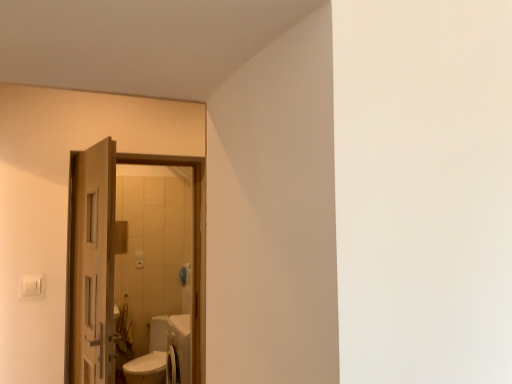
Where is `wooden door at left, placed as the 1th door when sorted from front to back`? wooden door at left, placed as the 1th door when sorted from front to back is located at coordinates (112, 258).

The width and height of the screenshot is (512, 384). Describe the element at coordinates (112, 258) in the screenshot. I see `wooden door at left, placed as the 1th door when sorted from front to back` at that location.

In order to face wooden door at left, positioned as the second door in back-to-front order, should I rotate leftwards or rightwards?

Rotate your view left by about 18.608°.

What do you see at coordinates (92, 265) in the screenshot?
I see `wooden door at left, marked as the second door in a front-to-back arrangement` at bounding box center [92, 265].

What is the approximate width of wooden door at left, marked as the second door in a front-to-back arrangement?

7.17 inches.

Locate an element on the screen. This screenshot has width=512, height=384. wooden door at left, marked as the second door in a front-to-back arrangement is located at coordinates (92, 265).

I want to click on wooden door at left, positioned as the second door in back-to-front order, so click(x=112, y=258).

Which is more to the left, wooden door at left, positioned as the second door in back-to-front order, or wooden door at left, the first door when ordered from back to front?

wooden door at left, the first door when ordered from back to front.

Which object is closer to the camera taking this photo, wooden door at left, placed as the 1th door when sorted from front to back, or wooden door at left, marked as the second door in a front-to-back arrangement?

Positioned in front is wooden door at left, placed as the 1th door when sorted from front to back.

Is point (95, 186) positioned behind point (97, 247)?

Yes, it is behind point (97, 247).

From the image's perspective, between wooden door at left, positioned as the second door in back-to-front order, and wooden door at left, the first door when ordered from back to front, which one is located above?

wooden door at left, positioned as the second door in back-to-front order.

From a real-world perspective, who is located higher, wooden door at left, positioned as the second door in back-to-front order, or wooden door at left, the first door when ordered from back to front?

wooden door at left, positioned as the second door in back-to-front order.

Can you confirm if wooden door at left, positioned as the second door in back-to-front order, is thinner than wooden door at left, the first door when ordered from back to front?

Yes.

Which of these two, wooden door at left, positioned as the second door in back-to-front order, or wooden door at left, the first door when ordered from back to front, stands taller?

wooden door at left, the first door when ordered from back to front, is taller.

Looking at the image, does wooden door at left, placed as the 1th door when sorted from front to back, seem bigger or smaller compared to wooden door at left, the first door when ordered from back to front?

In the image, wooden door at left, placed as the 1th door when sorted from front to back, appears to be smaller than wooden door at left, the first door when ordered from back to front.

Is wooden door at left, positioned as the second door in back-to-front order, outside of wooden door at left, the first door when ordered from back to front?

Yes, wooden door at left, positioned as the second door in back-to-front order, is not within wooden door at left, the first door when ordered from back to front.

Is wooden door at left, placed as the 1th door when sorted from front to back, with wooden door at left, marked as the second door in a front-to-back arrangement?

Yes, wooden door at left, placed as the 1th door when sorted from front to back, is touching wooden door at left, marked as the second door in a front-to-back arrangement.

Is wooden door at left, positioned as the second door in back-to-front order, facing away from wooden door at left, the first door when ordered from back to front?

No, wooden door at left, the first door when ordered from back to front, is not at the back of wooden door at left, positioned as the second door in back-to-front order.

The height and width of the screenshot is (384, 512). Find the location of `door located behind the wooden door at left, placed as the 1th door when sorted from front to back`. door located behind the wooden door at left, placed as the 1th door when sorted from front to back is located at coordinates point(92,265).

In the image, is wooden door at left, marked as the second door in a front-to-back arrangement, on the left side or the right side of wooden door at left, positioned as the second door in back-to-front order?

In the image, wooden door at left, marked as the second door in a front-to-back arrangement, appears on the left side of wooden door at left, positioned as the second door in back-to-front order.

Which is in front, wooden door at left, the first door when ordered from back to front, or wooden door at left, positioned as the second door in back-to-front order?

wooden door at left, positioned as the second door in back-to-front order, is closer to the camera.

Which is in front, point (72, 329) or point (97, 302)?

The point (97, 302) is in front.

From the image's perspective, is wooden door at left, marked as the second door in a front-to-back arrangement, located above or below wooden door at left, positioned as the second door in back-to-front order?

Clearly, from the image's perspective, wooden door at left, marked as the second door in a front-to-back arrangement, is below wooden door at left, positioned as the second door in back-to-front order.

From a real-world perspective, which object stands above the other?

wooden door at left, positioned as the second door in back-to-front order, from a real-world perspective.

Which of these two, wooden door at left, the first door when ordered from back to front, or wooden door at left, placed as the 1th door when sorted from front to back, is thinner?

wooden door at left, placed as the 1th door when sorted from front to back.

Who is taller, wooden door at left, the first door when ordered from back to front, or wooden door at left, positioned as the second door in back-to-front order?

wooden door at left, the first door when ordered from back to front.

Considering the relative sizes of wooden door at left, marked as the second door in a front-to-back arrangement, and wooden door at left, placed as the 1th door when sorted from front to back, in the image provided, is wooden door at left, marked as the second door in a front-to-back arrangement, bigger than wooden door at left, placed as the 1th door when sorted from front to back,?

Yes.

Looking at this image, would you say wooden door at left, the first door when ordered from back to front, contains wooden door at left, placed as the 1th door when sorted from front to back?

Actually, wooden door at left, placed as the 1th door when sorted from front to back, is outside wooden door at left, the first door when ordered from back to front.

Is there a large distance between wooden door at left, the first door when ordered from back to front, and wooden door at left, placed as the 1th door when sorted from front to back?

No.

From the picture: Is wooden door at left, marked as the second door in a front-to-back arrangement, facing away from wooden door at left, positioned as the second door in back-to-front order?

wooden door at left, marked as the second door in a front-to-back arrangement, is not turned away from wooden door at left, positioned as the second door in back-to-front order.

The width and height of the screenshot is (512, 384). In order to click on door on the right of the wooden door at left, marked as the second door in a front-to-back arrangement in this screenshot , I will do `click(112, 258)`.

The width and height of the screenshot is (512, 384). In the image, there is a wooden door at left, placed as the 1th door when sorted from front to back. Find the location of `door below it (from a real-world perspective)`. door below it (from a real-world perspective) is located at coordinates (92, 265).

Locate an element on the screen. door above the wooden door at left, marked as the second door in a front-to-back arrangement (from the image's perspective) is located at coordinates (112, 258).